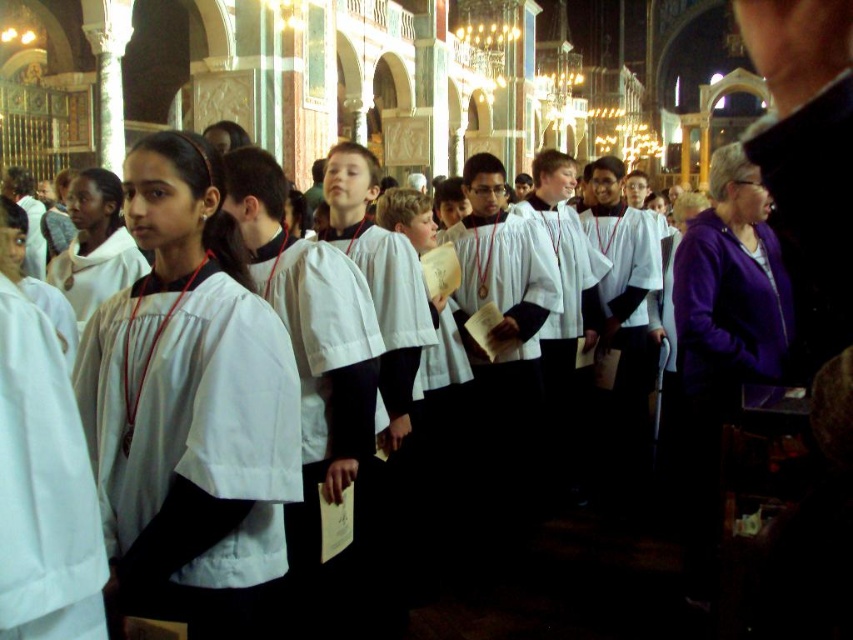
Between white matte/soft robe at center and white matte robe at left, which one appears on the left side from the viewer's perspective?

From the viewer's perspective, white matte robe at left appears more on the left side.

Is point (283, 570) closer to camera compared to point (38, 358)?

No, it is behind (38, 358).

Is point (115, 369) closer to camera compared to point (67, 422)?

No, it is not.

Locate an element on the screen. This screenshot has width=853, height=640. white matte/soft robe at center is located at coordinates (192, 445).